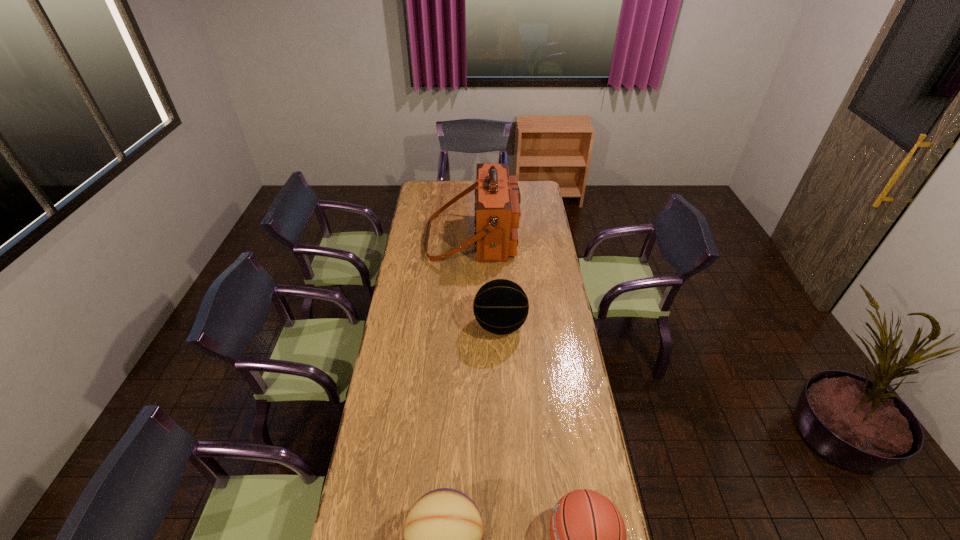
This screenshot has width=960, height=540. Find the location of `satchel`. satchel is located at coordinates (497, 204).

I want to click on the tallest object, so click(497, 204).

Locate an element on the screen. The height and width of the screenshot is (540, 960). the farthest basketball is located at coordinates (500, 306).

Image resolution: width=960 pixels, height=540 pixels. In order to click on vacant space situated 0.150m on the face side of the tallest object in this screenshot , I will do `click(546, 239)`.

The image size is (960, 540). What are the coordinates of `free location located 0.100m on the left of the farthest basketball` in the screenshot? It's located at [x=451, y=326].

The height and width of the screenshot is (540, 960). In order to click on object at the left edge in this screenshot , I will do `click(497, 204)`.

Locate an element on the screen. Image resolution: width=960 pixels, height=540 pixels. vacant area at the left edge is located at coordinates (395, 343).

Identify the location of vacant space at the right edge of the desktop. (540, 279).

In the image, there is a desktop. Where is `free space at the far left corner`? Image resolution: width=960 pixels, height=540 pixels. free space at the far left corner is located at coordinates (427, 186).

Locate an element on the screen. The image size is (960, 540). free space between the second farthest object and the tallest object is located at coordinates (487, 282).